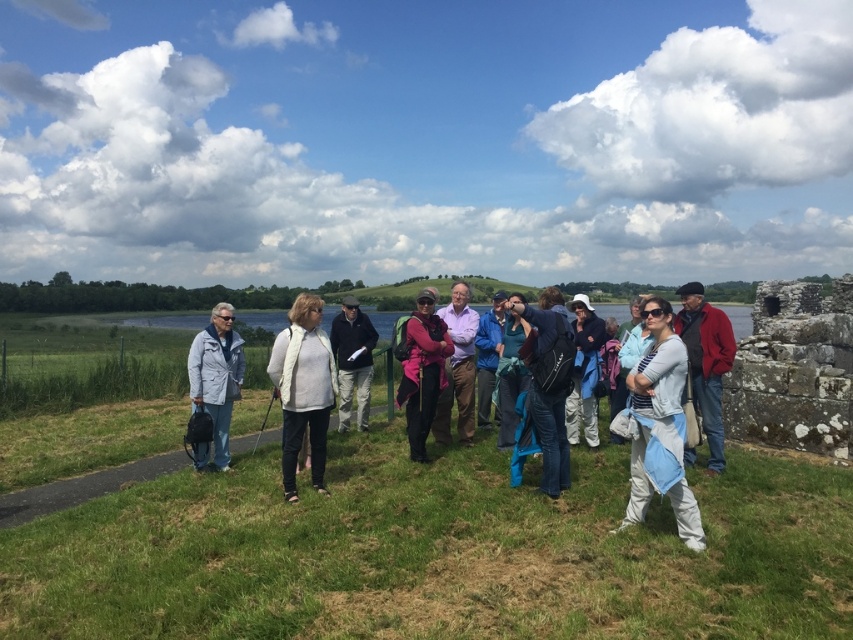
Question: Among these objects, which one is farthest from the camera?

Choices:
 (A) blue fabric jacket at center
 (B) red woolen jacket at center
 (C) light blue denim jacket at center
 (D) matte black jacket at center

Answer: (A)

Question: Can you confirm if red woolen jacket at center is positioned above light blue denim jacket at center?

Choices:
 (A) no
 (B) yes

Answer: (B)

Question: Which point is closer to the camera?

Choices:
 (A) green grassy at center
 (B) light blue denim jacket at center

Answer: (A)

Question: Which of the following is the farthest from the observer?

Choices:
 (A) pink fabric backpack at center
 (B) green grassy at center

Answer: (A)

Question: Can you confirm if light blue denim jacket at lower left is smaller than light blue denim jacket at center?

Choices:
 (A) yes
 (B) no

Answer: (A)

Question: Is blue denim jeans at center thinner than blue fabric jacket at center?

Choices:
 (A) no
 (B) yes

Answer: (A)